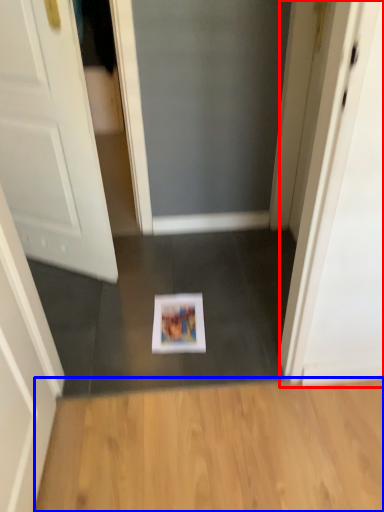
Question: Which object appears farthest to the camera in this image, screen door (highlighted by a red box) or hardwood (highlighted by a blue box)?

Choices:
 (A) screen door
 (B) hardwood

Answer: (A)